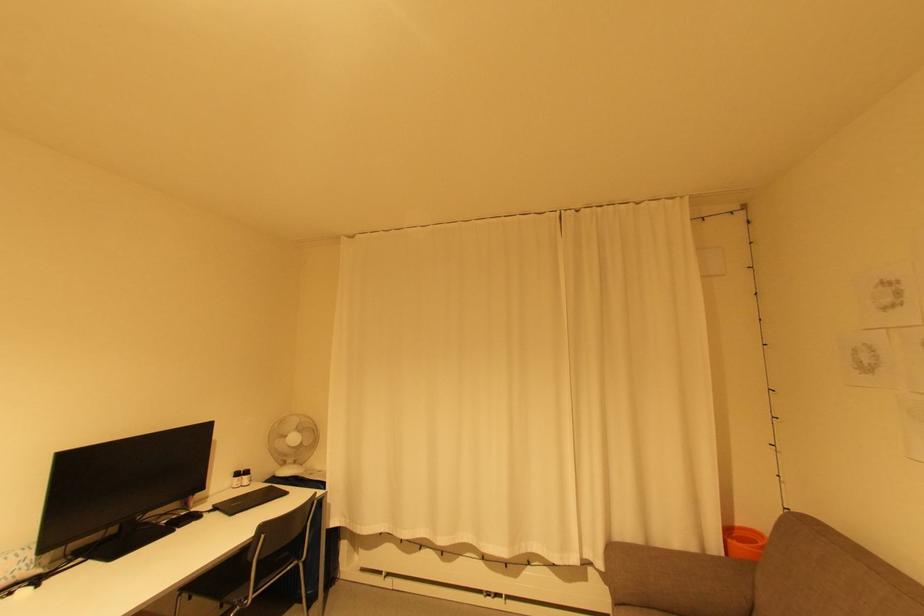
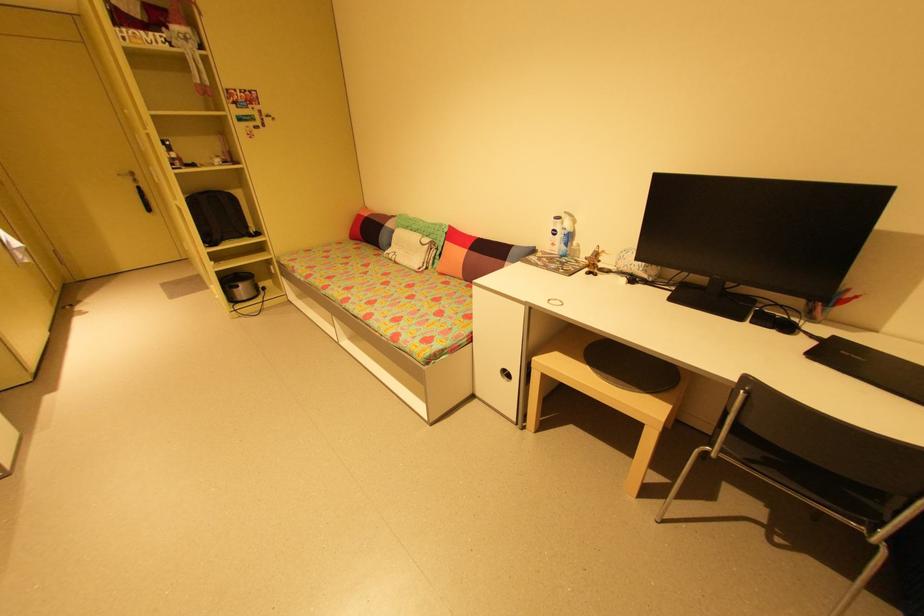
In the second image, find the point that corresponds to pixel 296 561 in the first image.

(869, 519)